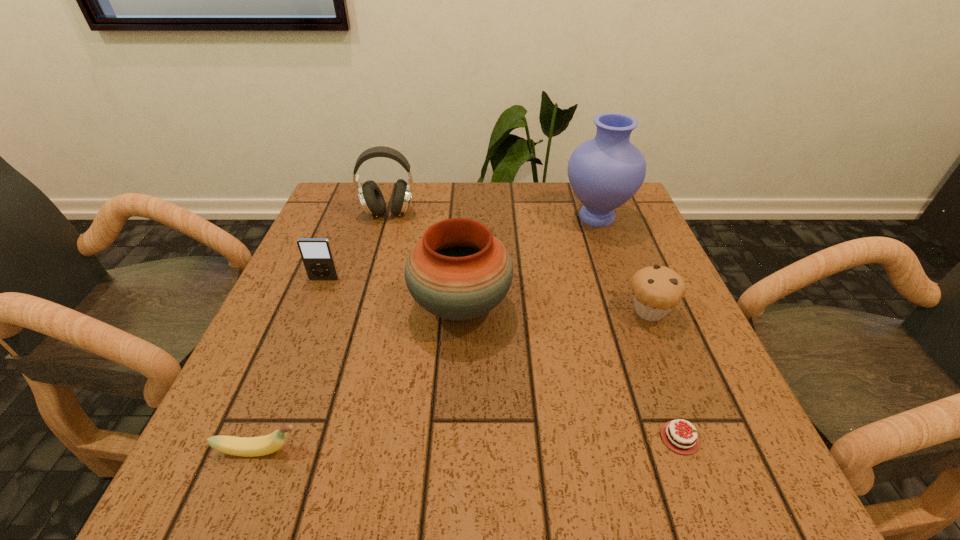
Identify the location of free space between the headset and the iPod. This screenshot has width=960, height=540. (356, 246).

This screenshot has width=960, height=540. Find the location of `blank region between the muffin and the fourth object from right to left`. blank region between the muffin and the fourth object from right to left is located at coordinates [555, 308].

Point out which object is positioned as the nearest to the iPod. Please provide its 2D coordinates. Your answer should be formatted as a tuple, i.e. [(x, y)], where the tuple contains the x and y coordinates of a point satisfying the conditions above.

[(458, 271)]

Where is `the closest object relative to the iPod`? the closest object relative to the iPod is located at coordinates (458, 271).

This screenshot has width=960, height=540. Identify the location of vacant space that satisfies the following two spatial constraints: 1. on the ear cups of the headset; 2. on the left side of the pottery. (363, 306).

The height and width of the screenshot is (540, 960). Identify the location of free spot that satisfies the following two spatial constraints: 1. on the ear cups of the headset; 2. on the right side of the muffin. (361, 311).

The height and width of the screenshot is (540, 960). I want to click on vacant space that satisfies the following two spatial constraints: 1. on the ear cups of the headset; 2. at the stem of the banana, so click(321, 451).